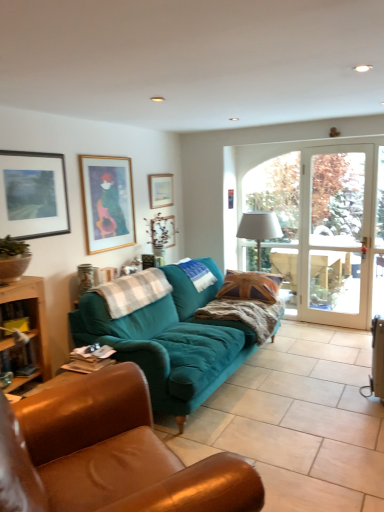
Question: From a real-world perspective, is union jack fabric pillow at center above or below white fabric lampshade at center?

Choices:
 (A) below
 (B) above

Answer: (A)

Question: Considering their positions, is union jack fabric pillow at center located in front of or behind white fabric lampshade at center?

Choices:
 (A) behind
 (B) front

Answer: (B)

Question: Estimate the real-world distances between objects in this image. Which object is closer to the wooden picture frame at upper center, positioned as the second picture frame in right-to-left order?

Choices:
 (A) matte black picture frame at upper left, the first picture frame viewed from the left
 (B) teal fabric couch at center, positioned as the first studio couch in front-to-back order
 (C) union jack fabric pillow at center
 (D) metallic silver picture frame at upper center, placed as the first picture frame when sorted from back to front
 (E) gold-framed picture at upper left, the 2th picture frame when ordered from front to back

Answer: (D)

Question: Which is farther from the wooden picture frame at upper center, the second picture frame viewed from the back?

Choices:
 (A) brown leather table at lower left
 (B) white glass door at right
 (C) matte black picture frame at upper left, which appears as the fourth picture frame when viewed from the back
 (D) white fabric lampshade at center
 (E) union jack fabric pillow at center

Answer: (A)